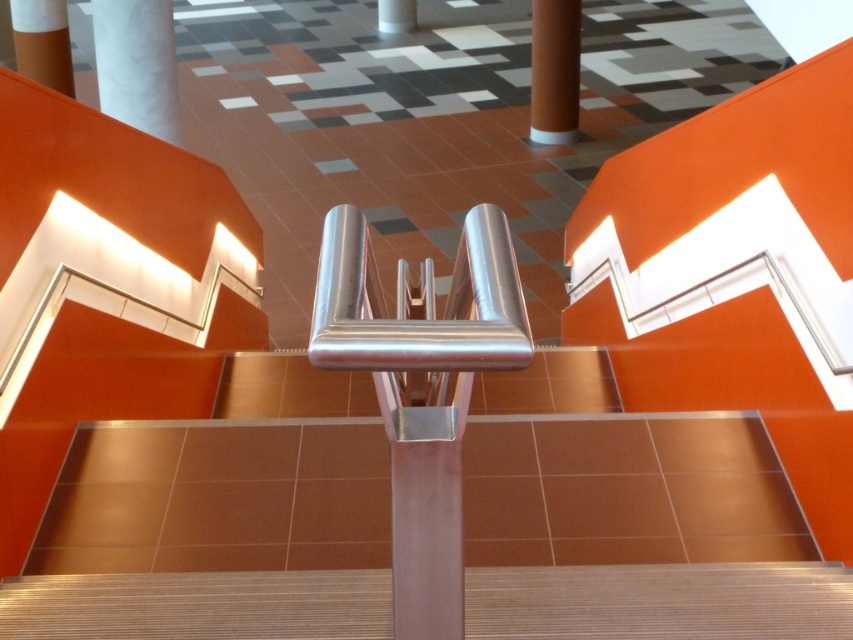
What do you see at coordinates (554, 70) in the screenshot? The height and width of the screenshot is (640, 853). I see `orange matte pillar at upper center` at bounding box center [554, 70].

Which is more to the left, orange matte pillar at upper center or smooth white pillar at center?

smooth white pillar at center

Find the location of a particular element. This screenshot has width=853, height=640. orange matte pillar at upper center is located at coordinates (554, 70).

Locate an element on the screen. The image size is (853, 640). orange matte pillar at upper center is located at coordinates (554, 70).

Who is higher up, matte orange pillar at upper left or smooth white pillar at center?

smooth white pillar at center is above.

Does matte orange pillar at upper left appear on the left side of smooth white pillar at center?

Yes, matte orange pillar at upper left is to the left of smooth white pillar at center.

Is point (45, 83) positioned after point (410, 4)?

No, (45, 83) is in front of (410, 4).

Image resolution: width=853 pixels, height=640 pixels. In order to click on matte orange pillar at upper left in this screenshot , I will do `click(42, 42)`.

Who is positioned more to the left, orange matte pillar at upper center or matte orange pillar at upper left?

Positioned to the left is matte orange pillar at upper left.

Who is more distant from viewer, (549, 33) or (57, 8)?

The point (549, 33) is behind.

The width and height of the screenshot is (853, 640). I want to click on orange matte pillar at upper center, so click(x=554, y=70).